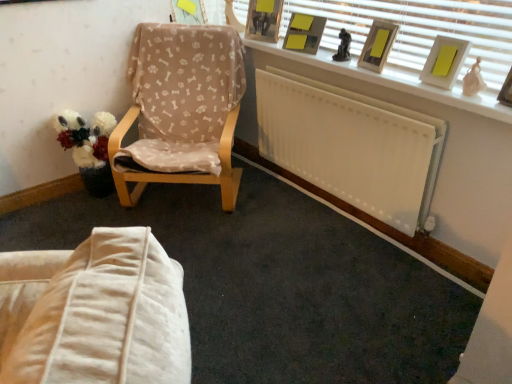
Question: Is beige fabric chair at left beside wooden picture frame at upper right, which is counted as the sixth picture frame, starting from the left?

Choices:
 (A) no
 (B) yes

Answer: (A)

Question: Can you confirm if beige fabric chair at left is bigger than wooden picture frame at upper right, positioned as the 1th picture frame in right-to-left order?

Choices:
 (A) no
 (B) yes

Answer: (B)

Question: From the image's perspective, would you say beige fabric chair at left is shown under wooden picture frame at upper right, which ranks as the first picture frame in front-to-back order?

Choices:
 (A) no
 (B) yes

Answer: (A)

Question: Considering the relative sizes of beige fabric chair at left and wooden picture frame at upper right, which is the sixth picture frame from back to front, in the image provided, is beige fabric chair at left smaller than wooden picture frame at upper right, which is the sixth picture frame from back to front,?

Choices:
 (A) yes
 (B) no

Answer: (B)

Question: Is beige fabric chair at left to the right of wooden picture frame at upper right, which is the sixth picture frame from back to front, from the viewer's perspective?

Choices:
 (A) no
 (B) yes

Answer: (A)

Question: In terms of width, does fluffy fabric bouquet at left look wider or thinner when compared to matte wooden picture frame at upper right, placed as the 3th picture frame when sorted from front to back?

Choices:
 (A) wide
 (B) thin

Answer: (A)

Question: Considering their positions, is fluffy fabric bouquet at left located in front of or behind matte wooden picture frame at upper right, marked as the 4th picture frame in a left-to-right arrangement?

Choices:
 (A) front
 (B) behind

Answer: (B)

Question: From a real-world perspective, is fluffy fabric bouquet at left above or below matte wooden picture frame at upper right, placed as the 3th picture frame when sorted from front to back?

Choices:
 (A) below
 (B) above

Answer: (A)

Question: Would you say fluffy fabric bouquet at left is inside or outside matte wooden picture frame at upper right, the third picture frame positioned from the right?

Choices:
 (A) outside
 (B) inside

Answer: (A)

Question: From their relative heights in the image, would you say wooden picture frame at upper center, the fifth picture frame positioned from the right, is taller or shorter than matte wooden picture frame at upper right, marked as the 4th picture frame in a left-to-right arrangement?

Choices:
 (A) tall
 (B) short

Answer: (A)

Question: From a real-world perspective, is wooden picture frame at upper center, which is the 5th picture frame in front-to-back order, positioned above or below matte wooden picture frame at upper right, the fourth picture frame when ordered from back to front?

Choices:
 (A) below
 (B) above

Answer: (B)

Question: Based on their sizes in the image, would you say wooden picture frame at upper center, the fifth picture frame positioned from the right, is bigger or smaller than matte wooden picture frame at upper right, placed as the 3th picture frame when sorted from front to back?

Choices:
 (A) small
 (B) big

Answer: (B)

Question: Looking at their shapes, would you say wooden picture frame at upper center, the fifth picture frame positioned from the right, is wider or thinner than matte wooden picture frame at upper right, the third picture frame positioned from the right?

Choices:
 (A) wide
 (B) thin

Answer: (A)

Question: From the image's perspective, is matte wooden picture frame at upper right, marked as the 4th picture frame in a left-to-right arrangement, above or below beige fabric chair at left?

Choices:
 (A) above
 (B) below

Answer: (A)

Question: Considering the positions of matte wooden picture frame at upper right, placed as the 3th picture frame when sorted from front to back, and beige fabric chair at left in the image, is matte wooden picture frame at upper right, placed as the 3th picture frame when sorted from front to back, bigger or smaller than beige fabric chair at left?

Choices:
 (A) small
 (B) big

Answer: (A)